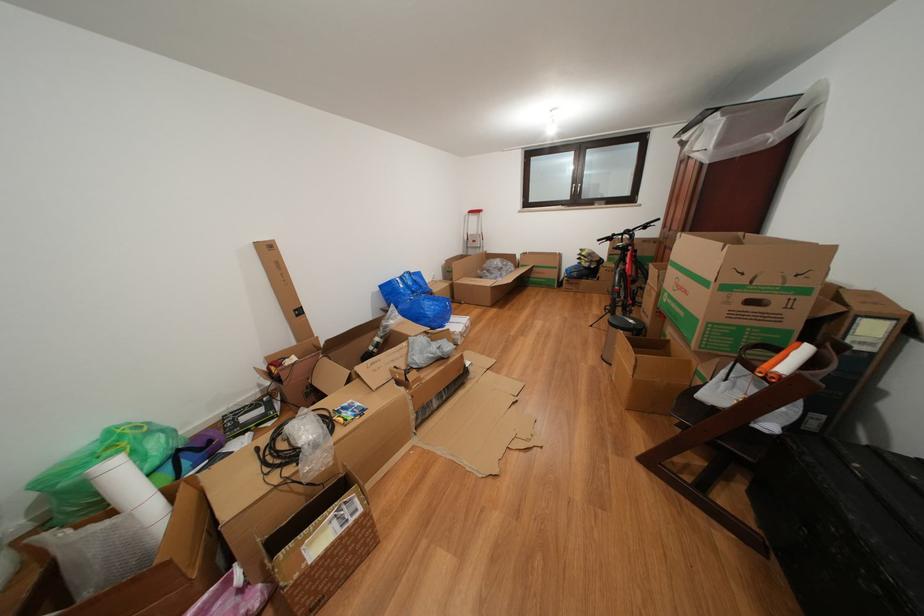
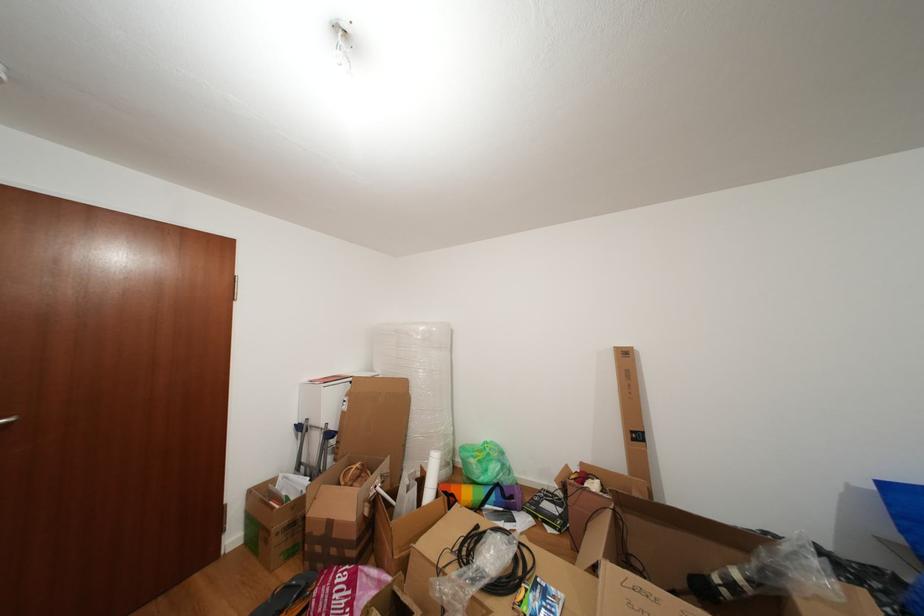
The point at [236,517] is marked in the first image. Where is the corresponding point in the second image?

(431, 548)